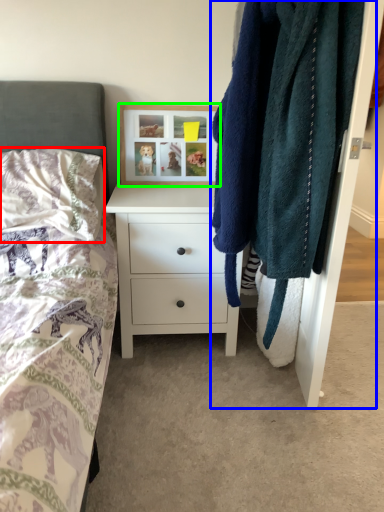
Question: Which object is the closest to the pillow (highlighted by a red box)? Choose among these: closet (highlighted by a blue box) or picture frame (highlighted by a green box).

Choices:
 (A) closet
 (B) picture frame

Answer: (B)